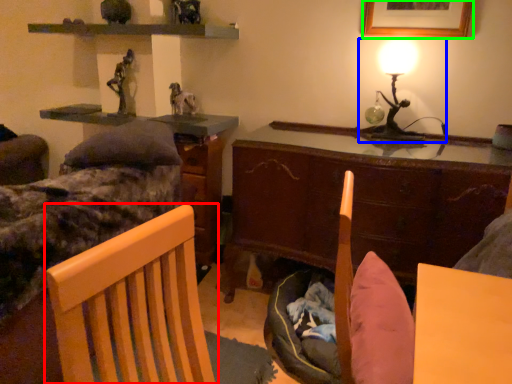
Question: Which object is positioned farthest from chair (highlighted by a red box)? Select from table lamp (highlighted by a blue box) and picture frame (highlighted by a green box).

Choices:
 (A) table lamp
 (B) picture frame

Answer: (B)